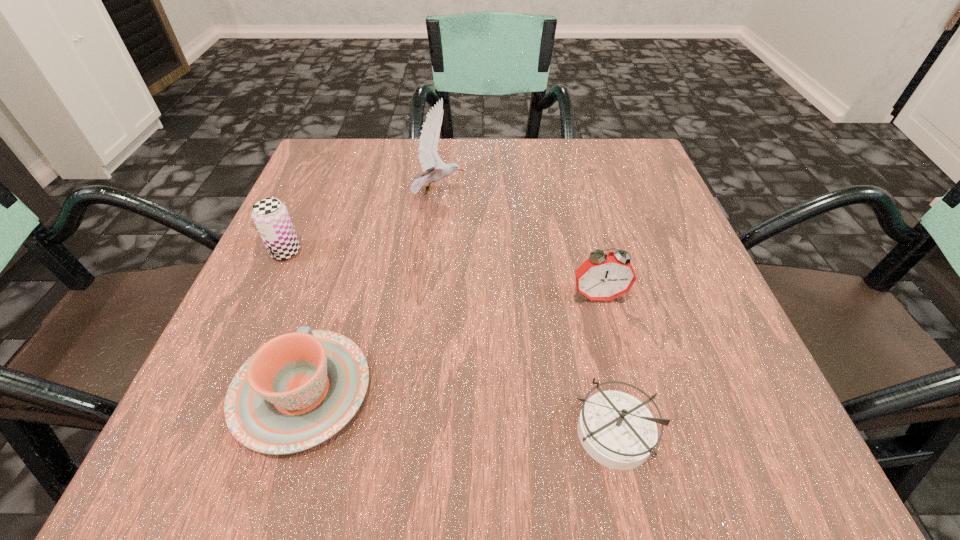
Where is `empty space that is in between the compass and the beer can`? The image size is (960, 540). empty space that is in between the compass and the beer can is located at coordinates (449, 342).

Where is `free spot between the third object from right to left and the second farthest object`? The width and height of the screenshot is (960, 540). free spot between the third object from right to left and the second farthest object is located at coordinates (362, 222).

Where is `vacant area that lies between the tallest object and the compass`? vacant area that lies between the tallest object and the compass is located at coordinates (525, 313).

Locate an element on the screen. vacant area that lies between the fourth nearest object and the tallest object is located at coordinates (362, 222).

You are a GUI agent. You are given a task and a screenshot of the screen. Output one action in this format:
    pyautogui.click(x=<x>, y=<y>)
    Task: Click on the vacant space that's between the chinaware and the compass
    
    Given the screenshot: What is the action you would take?
    pyautogui.click(x=457, y=412)

What are the coordinates of `empty space between the compass and the chinaware` in the screenshot? It's located at (457, 412).

You are a GUI agent. You are given a task and a screenshot of the screen. Output one action in this format:
    pyautogui.click(x=<x>, y=<y>)
    Task: Click on the blank region between the fourth nearest object and the chinaware
    
    Given the screenshot: What is the action you would take?
    pyautogui.click(x=294, y=322)

Locate which object ranks third in proximity to the third nearest object. Please provide its 2D coordinates. Your answer should be formatted as a tuple, i.e. [(x, y)], where the tuple contains the x and y coordinates of a point satisfying the conditions above.

[(299, 389)]

Locate an element on the screen. The image size is (960, 540). the second closest object relative to the beer can is located at coordinates coord(434,169).

This screenshot has height=540, width=960. In order to click on free space that satisfies the following two spatial constraints: 1. at the tip of the beak of the tallest object; 2. on the right side of the compass in this screenshot , I will do `click(410, 433)`.